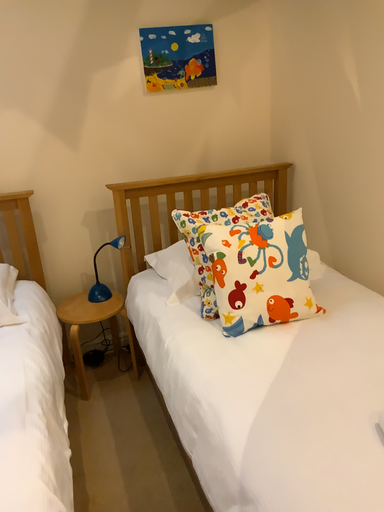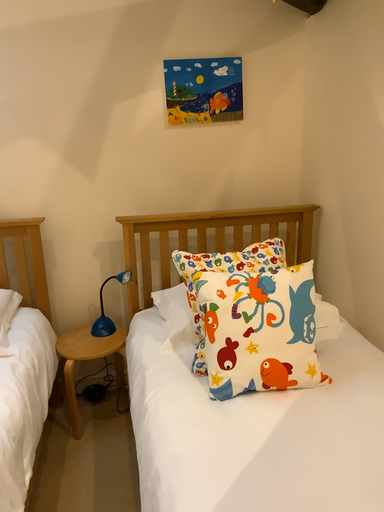
Question: How did the camera likely rotate when shooting the video?

Choices:
 (A) rotated left
 (B) rotated right

Answer: (A)